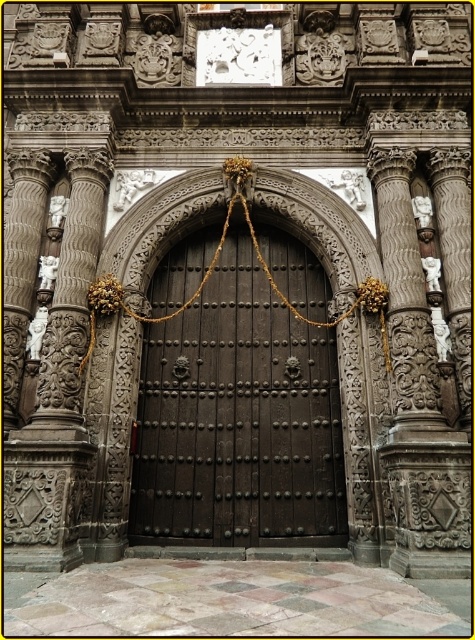
You are a painter who needs to know the height of the dark wood door at center and the gold rope at center to plan your painting. Which one is taller?

The dark wood door at center is taller than the gold rope at center according to the description.